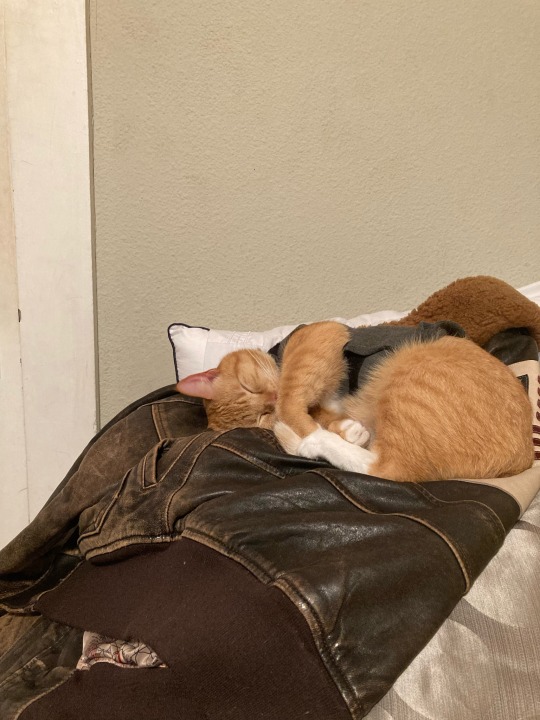
The image size is (540, 720). What are the coordinates of `wall` in the screenshot? It's located at (146, 286).